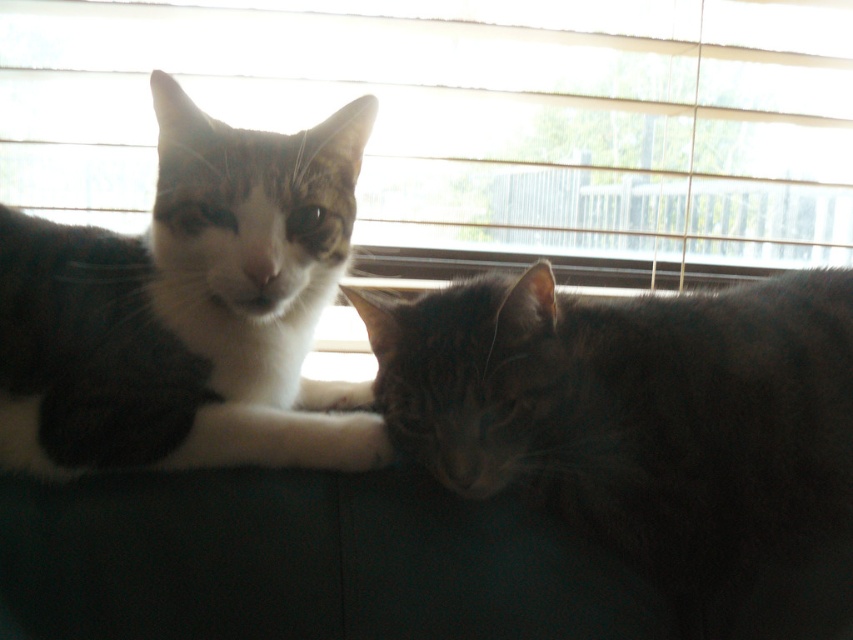
You are a cat owner who wants to place a small cat tree in the room. The cat tree requires a space of 0.2 meters in width. The point at coordinates (x=473, y=122) marks the location of the white wood blinds at upper center. Can you determine if the space between the two cats is wide enough to fit the cat tree?

The point at coordinates (x=473, y=122) marks the location of the white wood blinds at upper center. However, the distance between the two cats is not provided in the given information, so it is impossible to determine if the space between them is sufficient for the cat tree.

You are a small toy mouse that is 3 inches long. You want to roll from the white wood blinds at upper center to the dark gray fur cat at center. Can you reach the cat without any obstacles?

The distance between the white wood blinds at upper center and the dark gray fur cat at center is 34.53 inches. Since the toy mouse is only 3 inches long, it can easily roll the distance and reach the cat without any issues.

From the picture: You are standing in the room and want to reach a point that is exactly at coordinates point (689, 369). If your current position is 2.5 feet away from the camera, can you reach it without moving closer than 3 feet to the camera?

The distance of point (689, 369) from camera is 3.55 feet. Since your current position is 2.5 feet away from the camera, you need to move an additional 1.05 feet forward to reach the point. However, moving to 3.55 feet would place you beyond the 3 feet minimum distance required, so yes, you can reach it without violating the distance constraint.